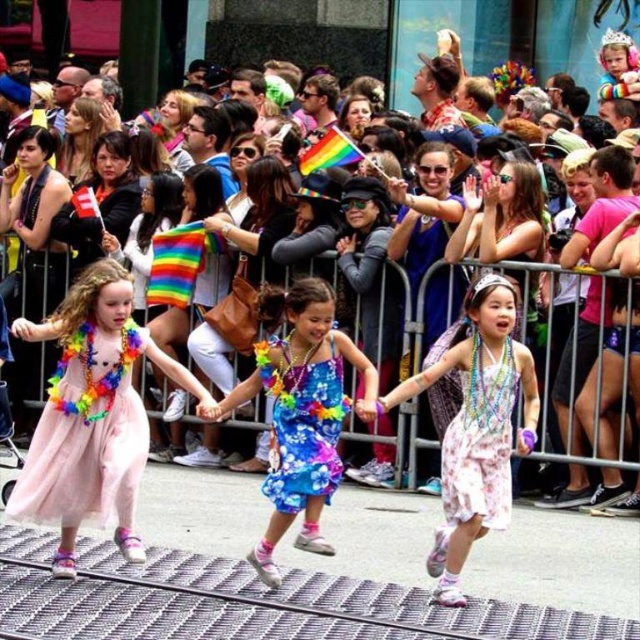
Question: Which point is closer to the camera?

Choices:
 (A) pink tulle dress at center
 (B) floral print fabric dress at center
 (C) floral cotton dress at center

Answer: (A)

Question: Which is nearer to the pink satin dress at lower left?

Choices:
 (A) pink tulle dress at center
 (B) floral print fabric dress at center

Answer: (A)

Question: Among these objects, which one is nearest to the camera?

Choices:
 (A) pink satin dress at lower left
 (B) floral print fabric dress at center
 (C) pink tulle dress at center
 (D) floral fabric dress at center

Answer: (C)

Question: Does pearl beaded necklace at center lie in front of pink satin dress at lower left?

Choices:
 (A) no
 (B) yes

Answer: (B)

Question: Is pink tulle dress at center to the left of pink satin dress at lower left from the viewer's perspective?

Choices:
 (A) no
 (B) yes

Answer: (B)

Question: Where is pink tulle dress at center located in relation to pink satin dress at lower left in the image?

Choices:
 (A) above
 (B) below

Answer: (A)